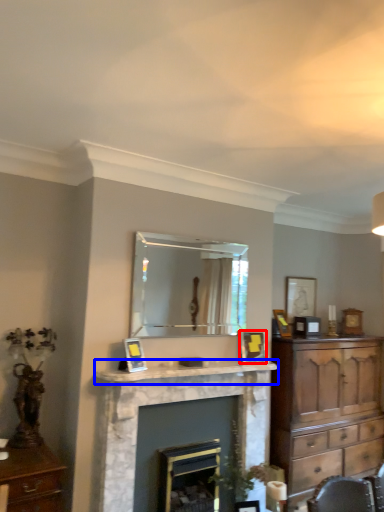
Question: Which of the following is the closest to the observer, picture frame (highlighted by a red box) or mantle (highlighted by a blue box)?

Choices:
 (A) picture frame
 (B) mantle

Answer: (B)